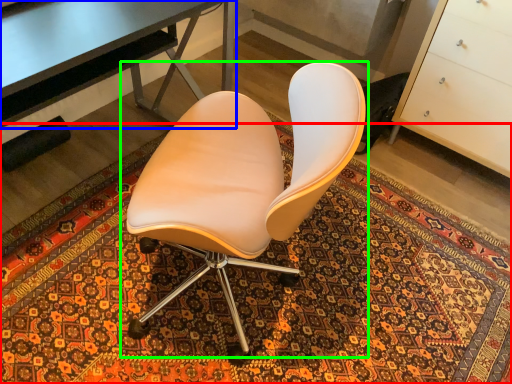
Question: Which object is positioned farthest from mat (highlighted by a red box)? Select from desk (highlighted by a blue box) and chair (highlighted by a green box).

Choices:
 (A) desk
 (B) chair

Answer: (A)